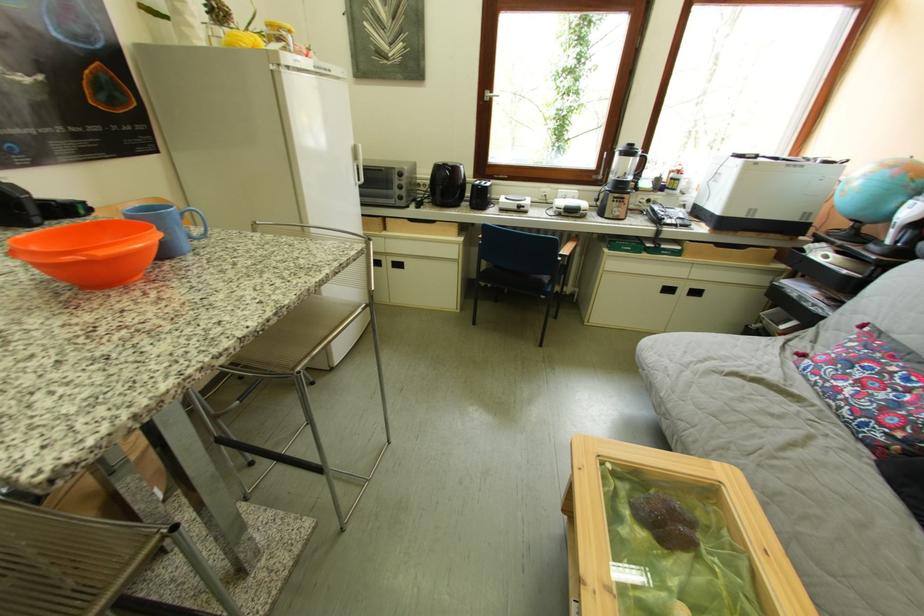
Where would you sit the sofa sitting surface? Please return your answer as a coordinate pair (x, y).

(878, 429)